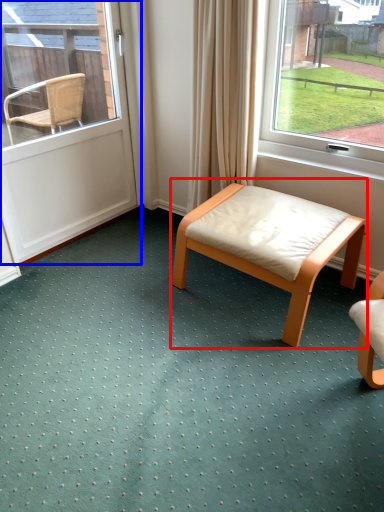
Question: Which object is further to the camera taking this photo, table (highlighted by a red box) or door (highlighted by a blue box)?

Choices:
 (A) table
 (B) door

Answer: (B)